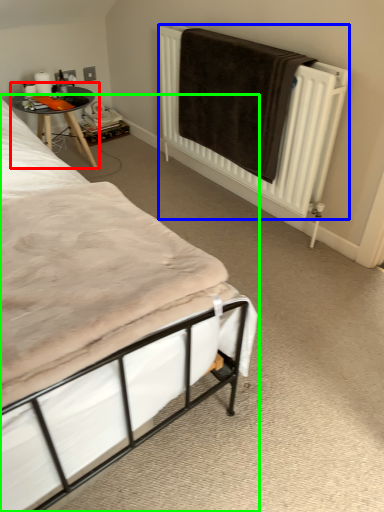
Question: Which object is positioned closest to table (highlighted by a red box)? Select from radiator (highlighted by a blue box) and bed (highlighted by a green box).

Choices:
 (A) radiator
 (B) bed

Answer: (A)